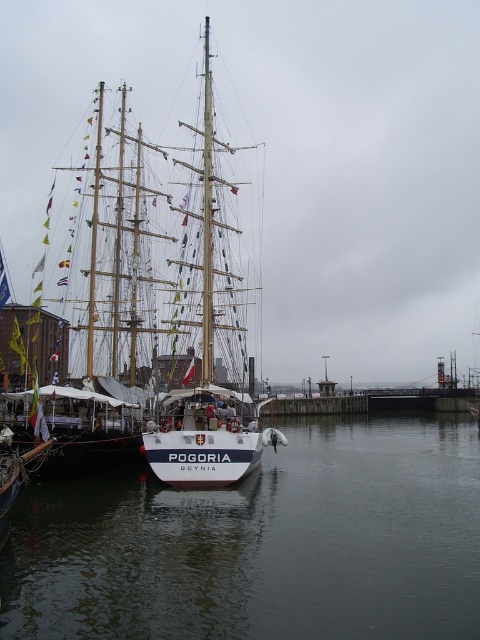
Who is taller, clear water at center or white matte sailboat at center?

With more height is white matte sailboat at center.

Does point (82, 593) come farther from viewer compared to point (217, 397)?

No, (82, 593) is closer to viewer.

I want to click on clear water at center, so click(263, 541).